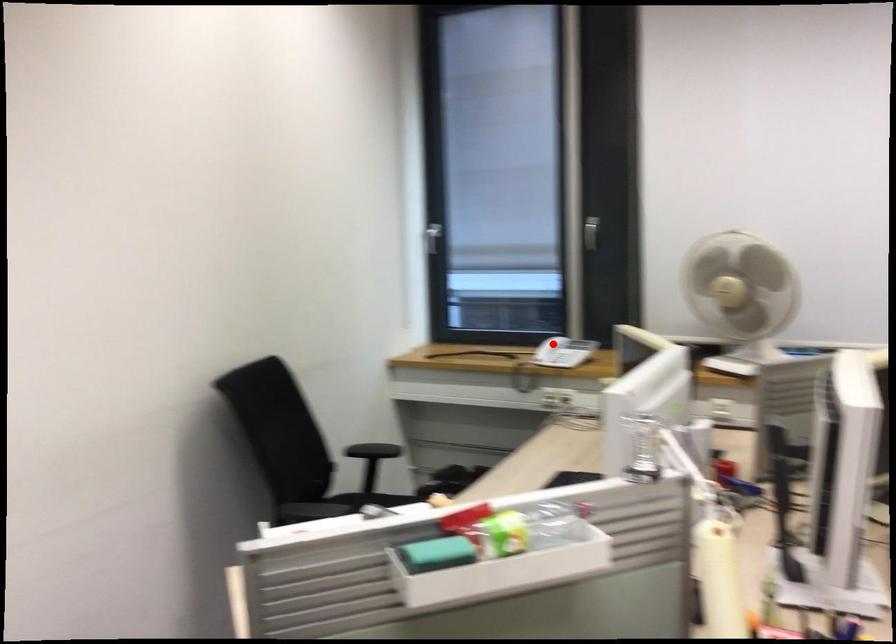
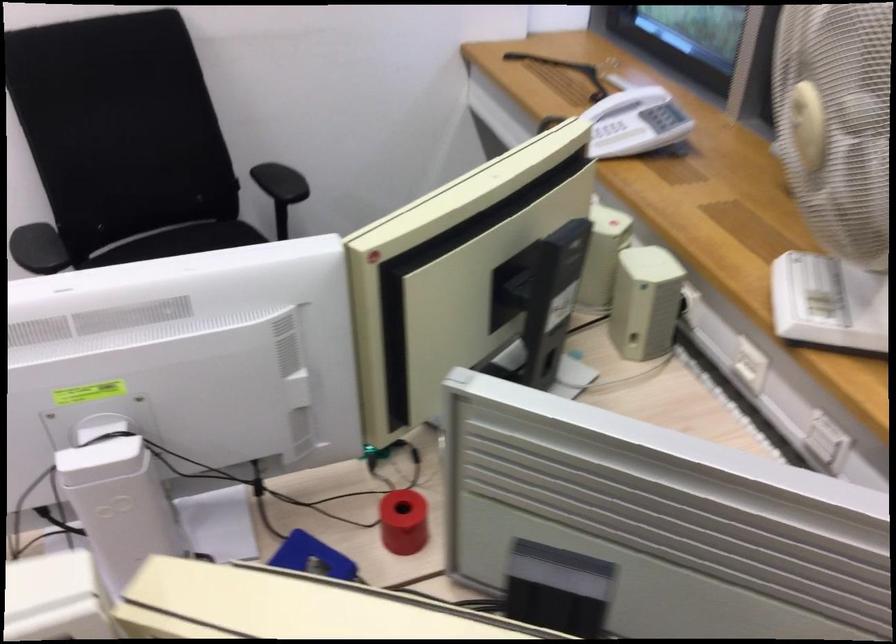
Locate, in the second image, the point that corresponds to the highlighted location in the first image.

(612, 131)